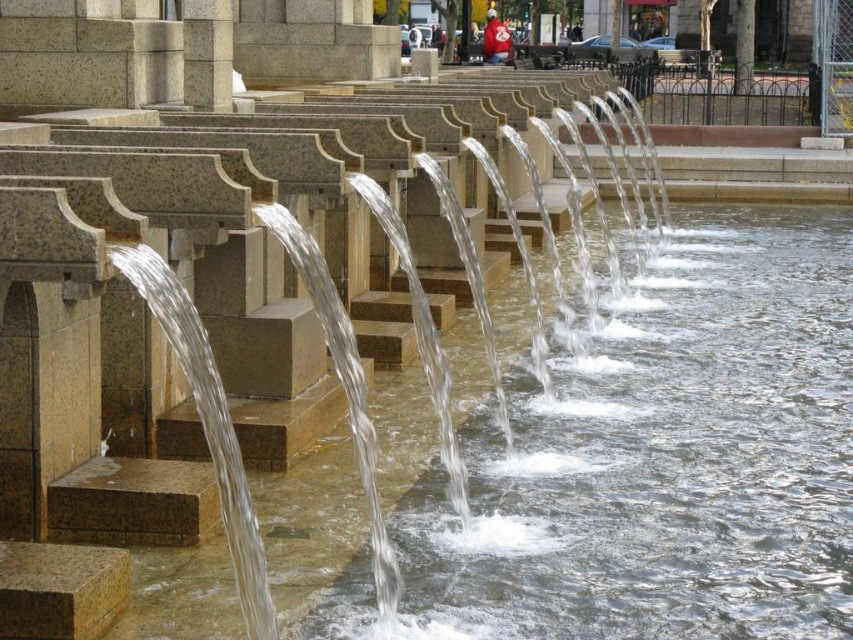
Which is above, clear water at center or granite pillar at center?

granite pillar at center

Who is shorter, clear water at center or granite pillar at center?

granite pillar at center is shorter.

Which is in front, point (795, 230) or point (204, 99)?

Point (204, 99) is in front.

Image resolution: width=853 pixels, height=640 pixels. In order to click on clear water at center in this screenshot , I will do `click(665, 458)`.